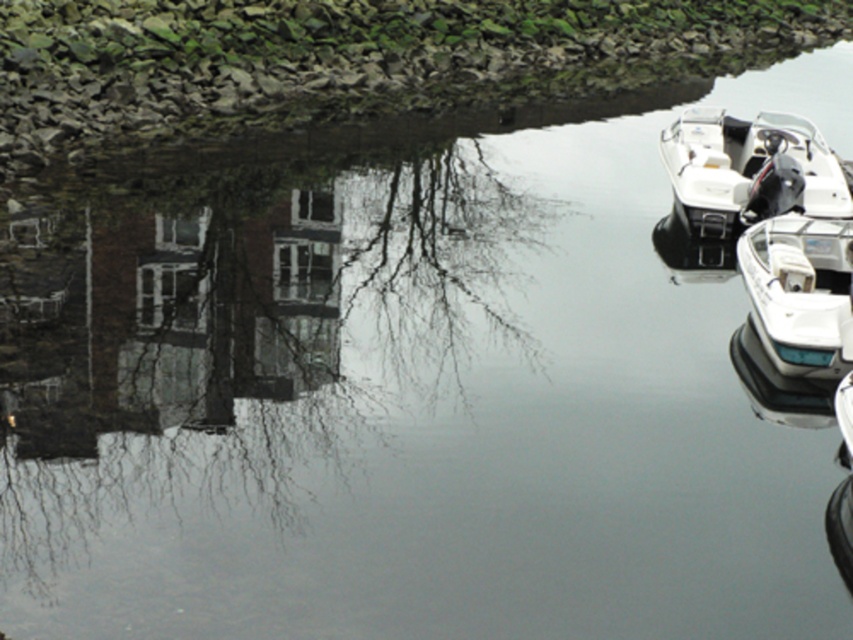
Question: Where is white plastic boat at right located in relation to white glossy boat at right in the image?

Choices:
 (A) below
 (B) above

Answer: (B)

Question: Is white plastic boat at right closer to the viewer compared to white glossy boat at right?

Choices:
 (A) no
 (B) yes

Answer: (A)

Question: Which object is farther from the camera taking this photo?

Choices:
 (A) white glossy boat at right
 (B) white plastic boat at right

Answer: (B)

Question: Is white plastic boat at right to the right of white glossy boat at right from the viewer's perspective?

Choices:
 (A) yes
 (B) no

Answer: (A)

Question: Which point is closer to the camera?

Choices:
 (A) pyautogui.click(x=775, y=349)
 (B) pyautogui.click(x=817, y=177)

Answer: (A)